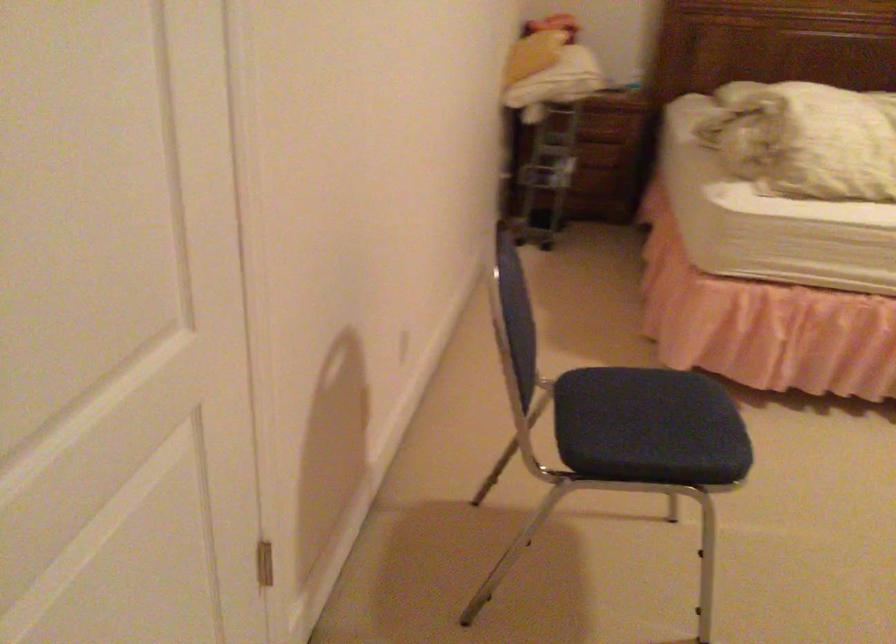
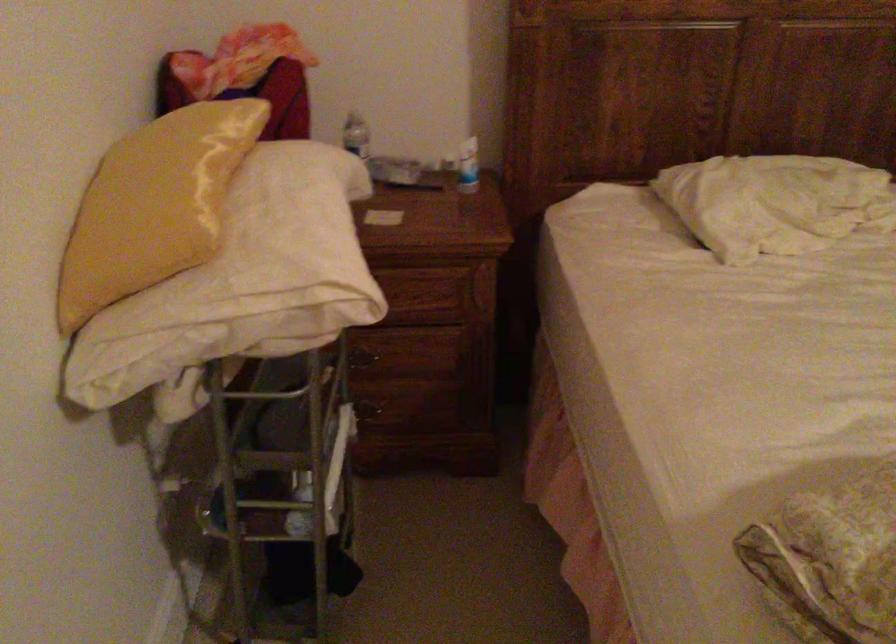
Where in the second image is the point corresponding to [590,144] from the first image?

(412, 365)